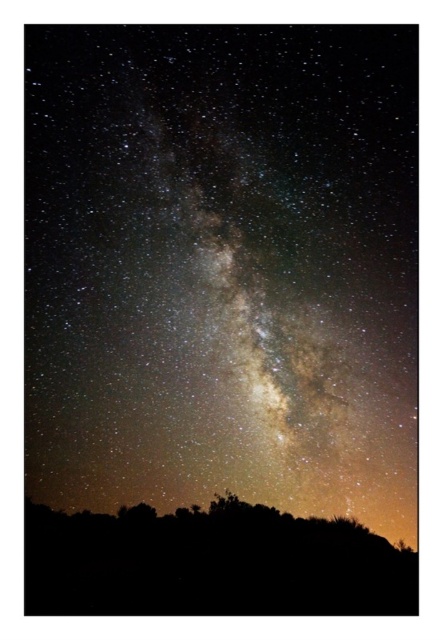
Question: Which object is farther from the camera taking this photo?

Choices:
 (A) milky way at center
 (B) silhouette vegetation at lower center

Answer: (A)

Question: Does milky way at center appear on the right side of silhouette vegetation at lower center?

Choices:
 (A) no
 (B) yes

Answer: (A)

Question: Does milky way at center have a greater width compared to silhouette vegetation at lower center?

Choices:
 (A) yes
 (B) no

Answer: (A)

Question: Is milky way at center positioned behind silhouette vegetation at lower center?

Choices:
 (A) no
 (B) yes

Answer: (B)

Question: Which point is farther to the camera?

Choices:
 (A) milky way at center
 (B) silhouette vegetation at lower center

Answer: (A)